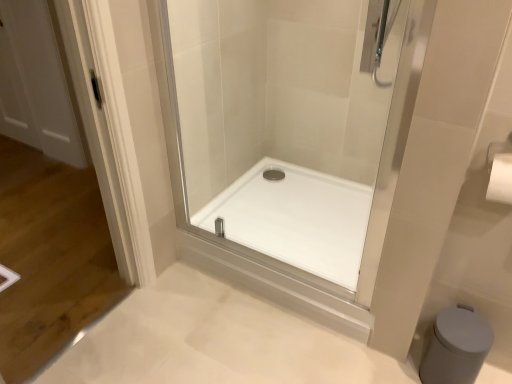
The image size is (512, 384). Describe the element at coordinates (296, 219) in the screenshot. I see `white glossy shower tray at center` at that location.

This screenshot has height=384, width=512. Describe the element at coordinates (291, 127) in the screenshot. I see `transparent glass shower door at center` at that location.

Locate an element on the screen. The image size is (512, 384). white glossy shower tray at center is located at coordinates (296, 219).

Considering the points (286, 201) and (443, 313), which point is behind, point (286, 201) or point (443, 313)?

Positioned behind is point (286, 201).

Locate an element on the screen. The image size is (512, 384). bidet that is below the transparent glass shower door at center (from the image's perspective) is located at coordinates (456, 347).

Is transparent glass shower door at center looking in the opposite direction of white matte bidet at lower right?

No, transparent glass shower door at center's orientation is not away from white matte bidet at lower right.

Considering the sizes of objects transparent glass shower door at center and white matte bidet at lower right in the image provided, who is bigger, transparent glass shower door at center or white matte bidet at lower right?

With larger size is transparent glass shower door at center.

Between white matte bidet at lower right and transparent glass shower door at center, which one appears on the left side from the viewer's perspective?

transparent glass shower door at center is more to the left.

From the image's perspective, is white matte bidet at lower right beneath transparent glass shower door at center?

Yes, from the image's perspective, white matte bidet at lower right is below transparent glass shower door at center.

Based on the photo, is white matte bidet at lower right wider or thinner than transparent glass shower door at center?

In the image, white matte bidet at lower right appears to be wider than transparent glass shower door at center.

Is point (314, 220) positioned before point (439, 350)?

No.

Is white glossy shower tray at center placed right next to white matte bidet at lower right?

There is a gap between white glossy shower tray at center and white matte bidet at lower right.

From a real-world perspective, is white glossy shower tray at center positioned above or below white matte bidet at lower right?

white glossy shower tray at center is above white matte bidet at lower right.

Which is behind, point (247, 234) or point (255, 237)?

The point (247, 234) is behind.

Is white glossy shower tray at center not within transparent glass shower door at center?

Yes, white glossy shower tray at center is located beyond the bounds of transparent glass shower door at center.

From the picture: Can you confirm if white glossy shower tray at center is bigger than transparent glass shower door at center?

Actually, white glossy shower tray at center might be smaller than transparent glass shower door at center.

Based on the photo, considering the sizes of objects white matte bidet at lower right and white glossy shower tray at center in the image provided, who is thinner, white matte bidet at lower right or white glossy shower tray at center?

white matte bidet at lower right is thinner.

Is white matte bidet at lower right facing away from white glossy shower tray at center?

No, white glossy shower tray at center is not at the back of white matte bidet at lower right.

Which of these two, white matte bidet at lower right or white glossy shower tray at center, stands shorter?

white glossy shower tray at center.

From a real-world perspective, is white matte bidet at lower right physically above white glossy shower tray at center?

No, from a real-world perspective, white matte bidet at lower right is not above white glossy shower tray at center.

This screenshot has width=512, height=384. What are the coordinates of `shower door in front of the white glossy shower tray at center` in the screenshot? It's located at (291, 127).

Considering the sizes of transparent glass shower door at center and white glossy shower tray at center in the image, is transparent glass shower door at center taller or shorter than white glossy shower tray at center?

In the image, transparent glass shower door at center appears to be taller than white glossy shower tray at center.

How different are the orientations of transparent glass shower door at center and white glossy shower tray at center in degrees?

transparent glass shower door at center and white glossy shower tray at center are facing 0.293 degrees away from each other.

Are transparent glass shower door at center and white glossy shower tray at center far apart?

No, transparent glass shower door at center is in close proximity to white glossy shower tray at center.

Locate an element on the screen. This screenshot has width=512, height=384. shower door to the left of white matte bidet at lower right is located at coordinates (291, 127).

Locate an element on the screen. The image size is (512, 384). shower door above the white matte bidet at lower right (from the image's perspective) is located at coordinates (291, 127).

Estimate the real-world distances between objects in this image. Which object is closer to white matte bidet at lower right, white glossy shower tray at center or transparent glass shower door at center?

white glossy shower tray at center.

When comparing their distances from white glossy shower tray at center, does white matte bidet at lower right or transparent glass shower door at center seem closer?

transparent glass shower door at center is positioned closer to the anchor white glossy shower tray at center.

Which object lies further to the anchor point transparent glass shower door at center, white matte bidet at lower right or white glossy shower tray at center?

Based on the image, white matte bidet at lower right appears to be further to transparent glass shower door at center.

In the scene shown: Based on their spatial positions, is transparent glass shower door at center or white matte bidet at lower right closer to white glossy shower tray at center?

The object closer to white glossy shower tray at center is transparent glass shower door at center.

Estimate the real-world distances between objects in this image. Which object is closer to white matte bidet at lower right, transparent glass shower door at center or white glossy shower tray at center?

Based on the image, white glossy shower tray at center appears to be nearer to white matte bidet at lower right.

Considering their positions, is white glossy shower tray at center positioned further to transparent glass shower door at center than white matte bidet at lower right?

white matte bidet at lower right.

Where is `bath between transparent glass shower door at center and white matte bidet at lower right in the vertical direction`? bath between transparent glass shower door at center and white matte bidet at lower right in the vertical direction is located at coordinates (296, 219).